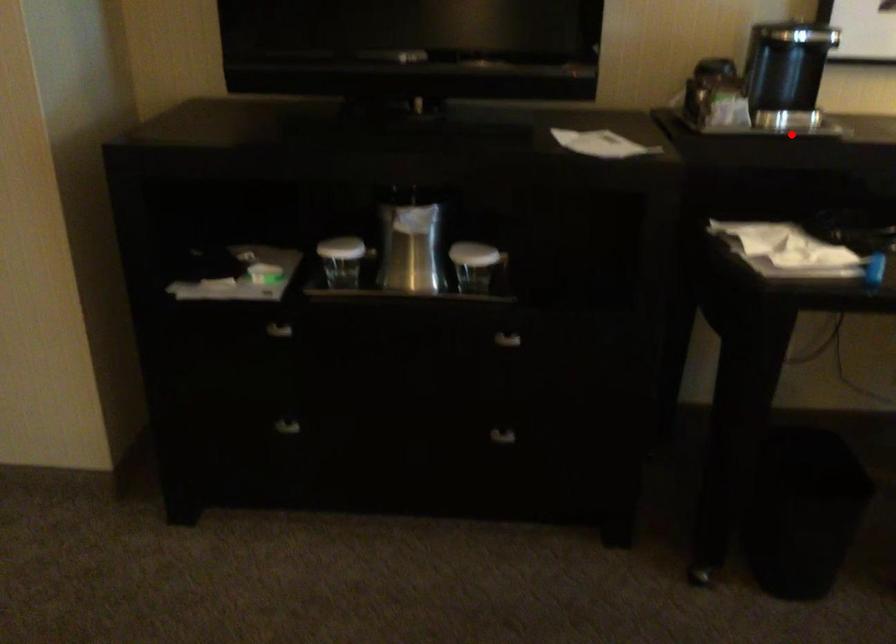
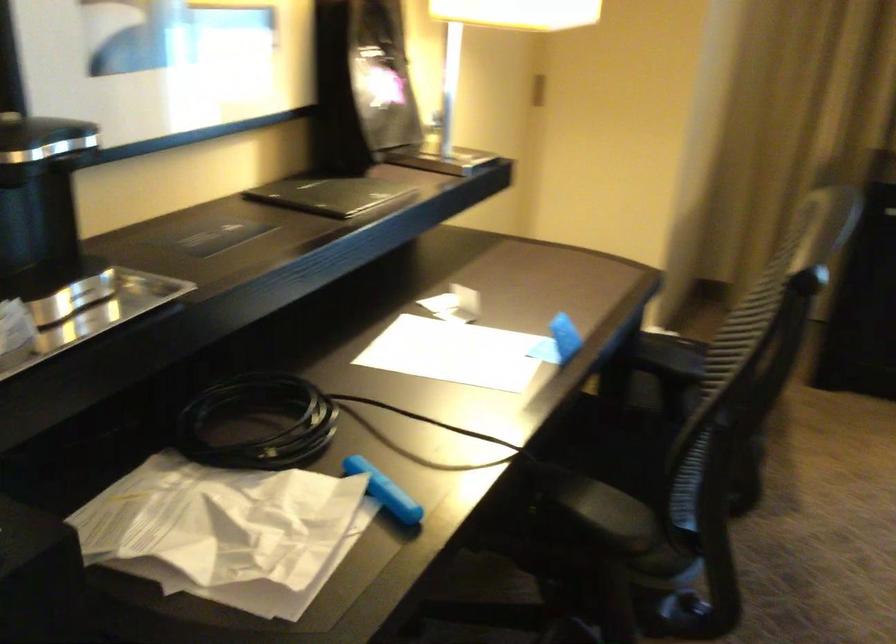
Question: A red point is marked in image1. In image2, is the corresponding 3D point closer to the camera or farther? Reply with the corresponding letter.

Choices:
 (A) The corresponding 3D point is closer.
 (B) The corresponding 3D point is farther.

Answer: (A)